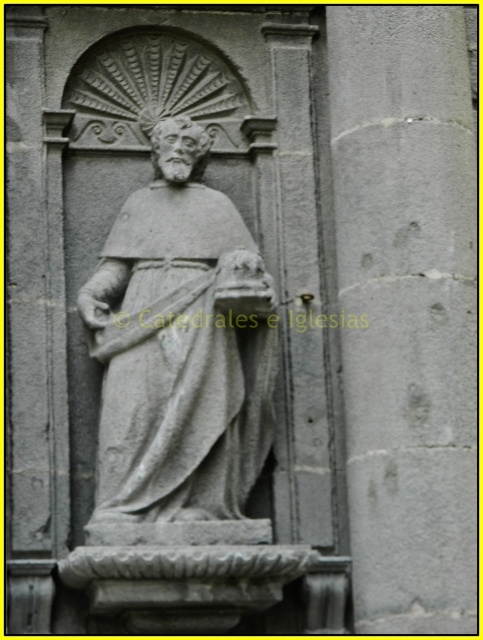
Question: Which object is farther from the camera taking this photo?

Choices:
 (A) gray stone pillar at center
 (B) gray stone statue at center

Answer: (B)

Question: Which point is farther to the camera?

Choices:
 (A) gray stone pillar at center
 (B) gray stone statue at center

Answer: (B)

Question: Can you confirm if gray stone pillar at center is positioned above gray stone statue at center?

Choices:
 (A) no
 (B) yes

Answer: (B)

Question: Can you confirm if gray stone pillar at center is positioned below gray stone statue at center?

Choices:
 (A) yes
 (B) no

Answer: (B)

Question: Which object is farther from the camera taking this photo?

Choices:
 (A) gray stone pillar at center
 (B) gray stone statue at center

Answer: (B)

Question: Is gray stone pillar at center to the right of gray stone statue at center from the viewer's perspective?

Choices:
 (A) no
 (B) yes

Answer: (B)